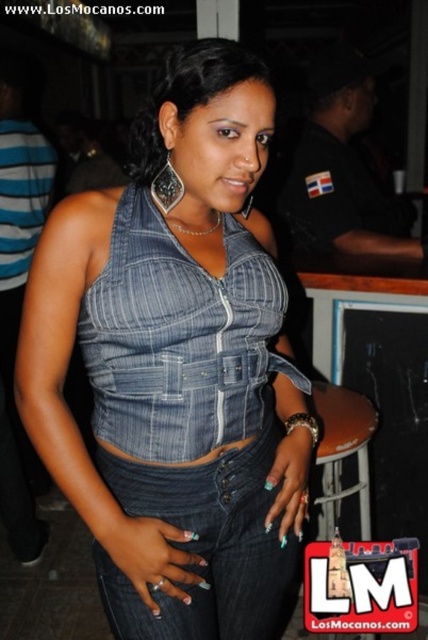
Who is lower down, denim jeans at center or denim top at center?

denim jeans at center

Is point (216, 492) positioned before point (133, 125)?

Yes, it is in front of point (133, 125).

Is point (273, 499) behind point (204, 67)?

That is True.

Identify the location of denim jeans at center. The height and width of the screenshot is (640, 428). (207, 547).

Which is in front, point (121, 595) or point (237, 547)?

Point (121, 595) is more forward.

Which is more to the left, denim at center or denim jeans at center?

From the viewer's perspective, denim at center appears more on the left side.

Does point (196, 88) come farther from viewer compared to point (142, 636)?

No.

Locate an element on the screen. denim at center is located at coordinates (177, 365).

Does black uniform at upper center appear on the right side of denim top at center?

Indeed, black uniform at upper center is positioned on the right side of denim top at center.

Is black uniform at upper center above denim top at center?

Yes.

What do you see at coordinates (341, 170) in the screenshot?
I see `black uniform at upper center` at bounding box center [341, 170].

The height and width of the screenshot is (640, 428). Identify the location of black uniform at upper center. (341, 170).